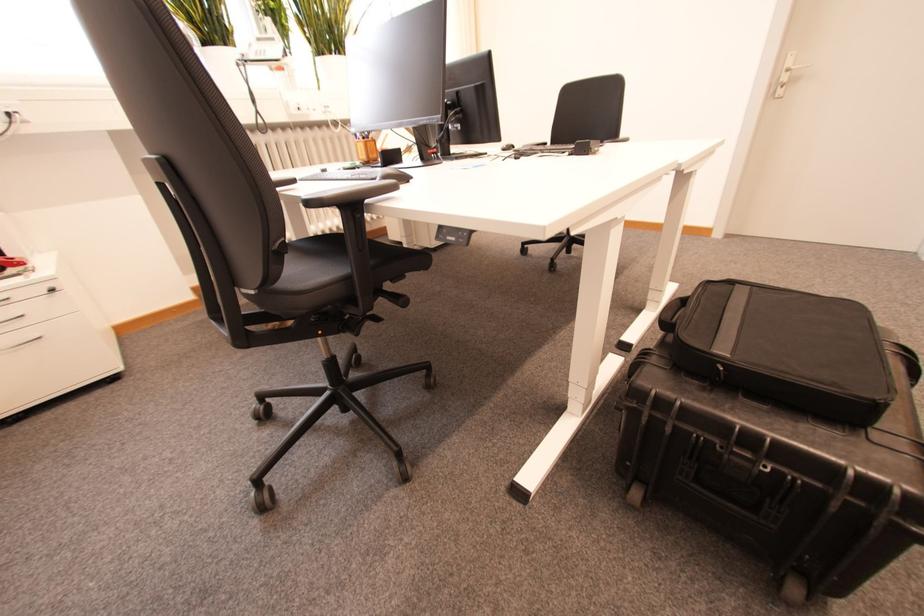
The image size is (924, 616). In order to click on white door handle in this screenshot , I will do `click(786, 74)`.